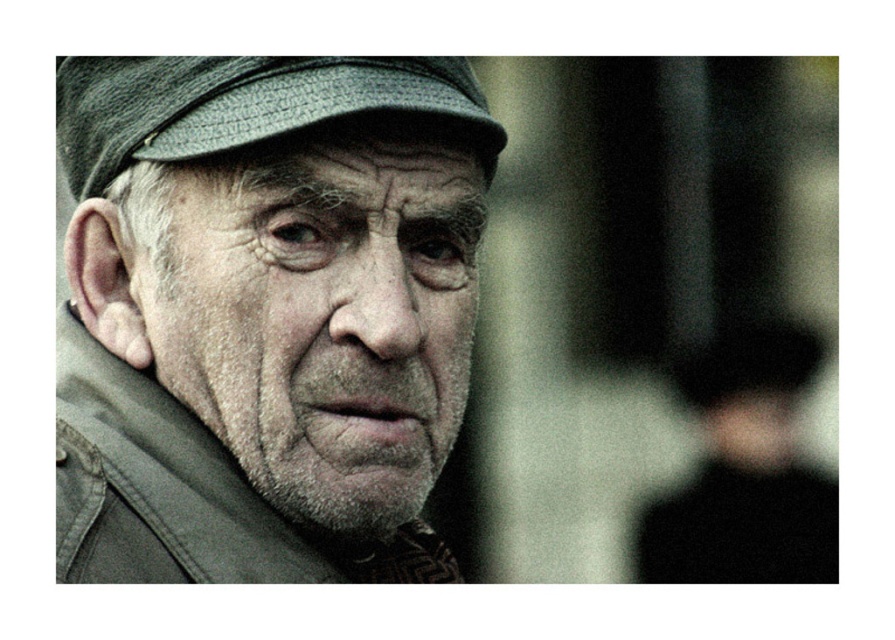
Which of these two, textured gray beret at upper left or black matte hat at right, stands taller?

Standing taller between the two is black matte hat at right.

Which is below, textured gray beret at upper left or black matte hat at right?

Positioned lower is black matte hat at right.

Is point (116, 141) in front of point (692, 556)?

That is True.

This screenshot has width=895, height=640. Identify the location of textured gray beret at upper left. (249, 106).

The width and height of the screenshot is (895, 640). What do you see at coordinates (320, 312) in the screenshot? I see `matte gray cap at center` at bounding box center [320, 312].

Is point (339, 326) positioned before point (788, 561)?

Yes, point (339, 326) is in front of point (788, 561).

At what (x,y) coordinates should I click in order to perform the action: click on matte gray cap at center. Please return your answer as a coordinate pair (x, y). The image size is (895, 640). Looking at the image, I should click on (320, 312).

Who is shorter, matte gray cap at center or textured gray beret at upper left?

With less height is textured gray beret at upper left.

Is point (454, 243) more distant than point (132, 68)?

Yes, it is.

You are a GUI agent. You are given a task and a screenshot of the screen. Output one action in this format:
    pyautogui.click(x=<x>, y=<y>)
    Task: Click on the matte gray cap at center
    
    Given the screenshot: What is the action you would take?
    pyautogui.click(x=320, y=312)